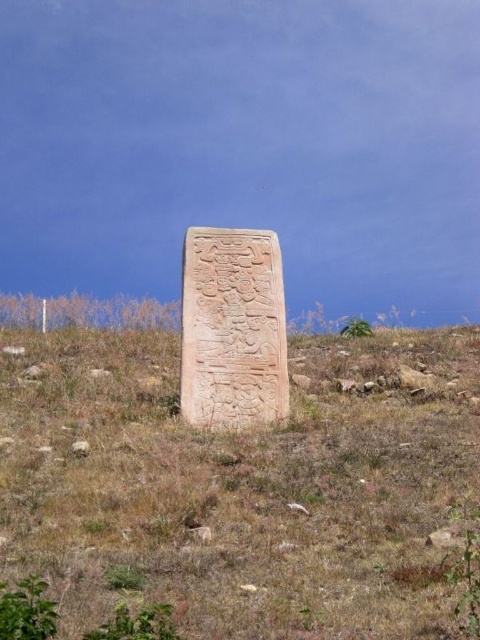
You are a landscape architect designing a pathway that needs to pass between the brown grassy at center and the carved stone monument at center. What is the minimum width required for the pathway to ensure there is enough space between them?

The brown grassy at center and the carved stone monument at center are 8.78 feet apart from each other. Therefore, the minimum width required for the pathway should be at least 8.78 feet to accommodate the space between them.

In the scene shown: You are a gardener planning to mow the brown grassy at center. However, you need to avoid damaging the carved stone monument at center. Based on the scene, can you determine if the grassy area is wide enough to mow around the monument without hitting it?

The brown grassy at center might be wider than carved stone monument at center, so there is a possibility that the grassy area is wide enough to mow around the monument without hitting it. However, the exact width difference is uncertain as the description only states it might be wider.

You are a photographer planning to take a photo of the carved stone monument at center. You notice there is brown grassy at center in the foreground. Will the grass block the monument in the photo if you take it from this angle?

The brown grassy at center is shorter than the carved stone monument at center, so the grass will not block the monument in the photo from this angle.